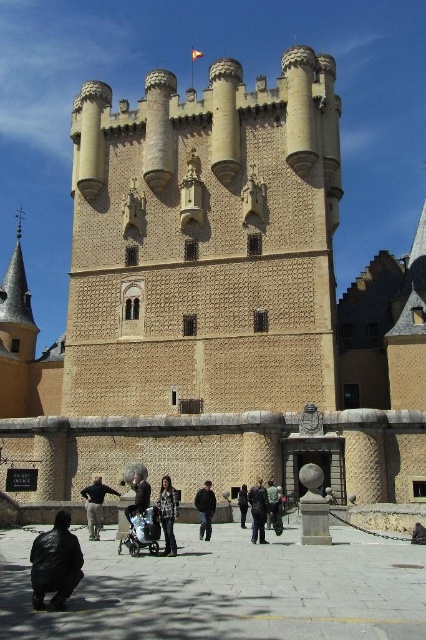
Question: Which object appears farthest from the camera in this image?

Choices:
 (A) dark brown leather jacket at lower left
 (B) dark blue jeans at center
 (C) dark green fabric jacket at center
 (D) dark gray fabric coat at center

Answer: (D)

Question: Which of the following is the closest to the observer?

Choices:
 (A) black leather jacket at center
 (B) dark gray fabric coat at center
 (C) black leather jacket at lower left

Answer: (C)

Question: Does black leather jacket at lower left appear on the left side of dark blue jeans at center?

Choices:
 (A) no
 (B) yes

Answer: (B)

Question: Is black textured jacket at center to the left of dark brown leather jacket at lower left from the viewer's perspective?

Choices:
 (A) yes
 (B) no

Answer: (B)

Question: Can you confirm if black textured jacket at center is bigger than dark blue jeans at center?

Choices:
 (A) yes
 (B) no

Answer: (A)

Question: Which point appears farthest from the camera in this image?

Choices:
 (A) (91, 493)
 (B) (244, 484)
 (C) (270, 497)

Answer: (B)